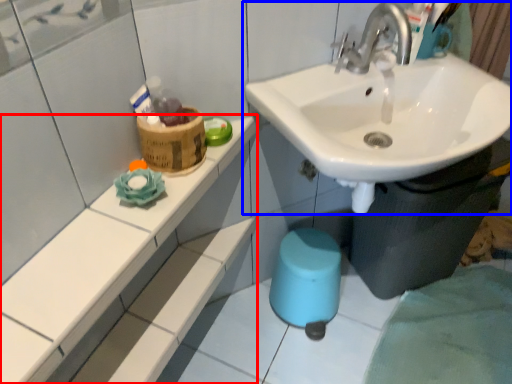
Question: Which object appears farthest to the camera in this image, counter top (highlighted by a red box) or sink (highlighted by a blue box)?

Choices:
 (A) counter top
 (B) sink

Answer: (B)